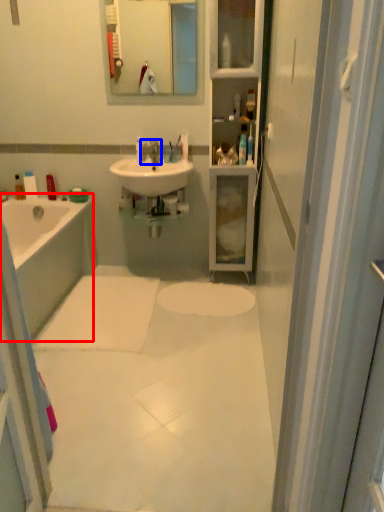
Question: Which object appears closest to the camera in this image, bathtub (highlighted by a red box) or tap (highlighted by a blue box)?

Choices:
 (A) bathtub
 (B) tap

Answer: (A)